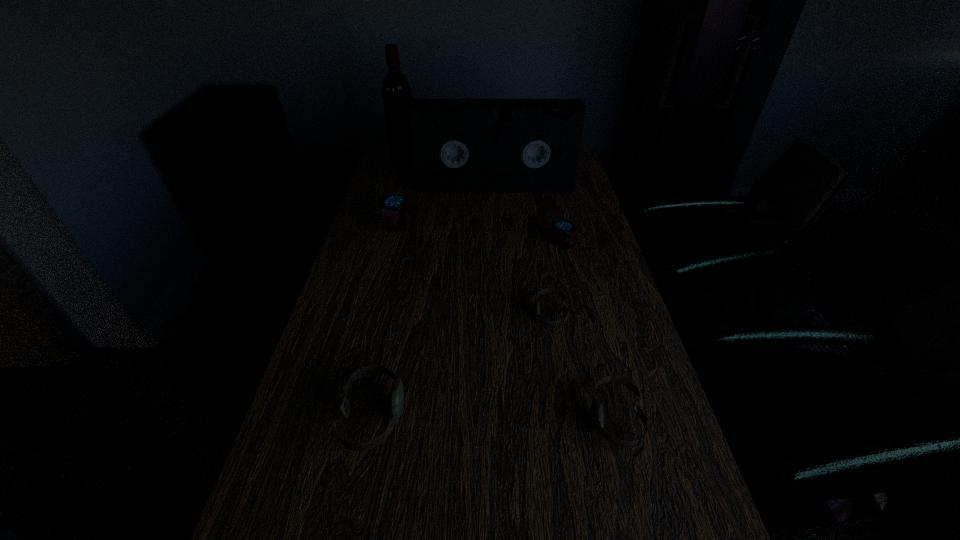
Locate an element on the screen. vacant region at the right edge of the desktop is located at coordinates (566, 265).

The height and width of the screenshot is (540, 960). In order to click on vacant area that lies between the fourth farthest object and the left red watch in this screenshot , I will do `click(479, 235)`.

Find the location of `unoccupied area between the rightmost beige watch and the fifth shortest object`. unoccupied area between the rightmost beige watch and the fifth shortest object is located at coordinates [506, 322].

Locate an element on the screen. Image resolution: width=960 pixels, height=540 pixels. free spot between the second shortest watch and the red wine bottle is located at coordinates (510, 286).

The width and height of the screenshot is (960, 540). Find the location of `empty space between the fifth nearest object and the smaller red watch`. empty space between the fifth nearest object and the smaller red watch is located at coordinates (479, 235).

The height and width of the screenshot is (540, 960). I want to click on vacant area that lies between the sixth nearest object and the leftmost beige watch, so click(434, 301).

The image size is (960, 540). I want to click on unoccupied area between the sixth tallest object and the biggest beige watch, so click(x=494, y=416).

You are a GUI agent. You are given a task and a screenshot of the screen. Output one action in this format:
    pyautogui.click(x=<x>, y=<y>)
    Task: Click on the unoccupied position between the second biggest beige watch and the sixth nearest object
    
    Given the screenshot: What is the action you would take?
    pyautogui.click(x=555, y=302)

Choose which object is the fourth nearest neighbor to the wine bottle. Please provide its 2D coordinates. Your answer should be formatted as a tuple, i.e. [(x, y)], where the tuple contains the x and y coordinates of a point satisfying the conditions above.

[(536, 305)]

Select which object appears as the third closest to the smaller red watch. Please provide its 2D coordinates. Your answer should be formatted as a tuple, i.e. [(x, y)], where the tuple contains the x and y coordinates of a point satisfying the conditions above.

[(394, 208)]